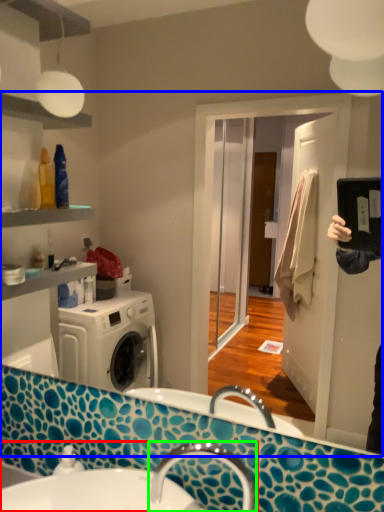
Question: Based on their relative distances, which object is nearer to sink (highlighted by a red box)? Choose from mirror (highlighted by a blue box) and tap (highlighted by a green box).

Choices:
 (A) mirror
 (B) tap

Answer: (B)